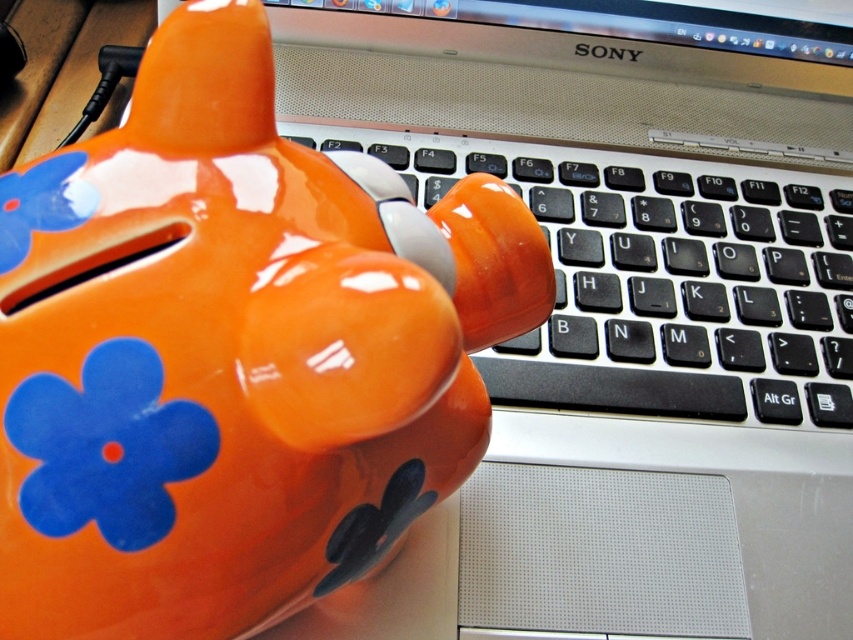
You are organizing your desk and want to place the glossy ceramic piggy bank at upper left closer to the black plastic keyboard at center. Are they currently overlapping in the image?

The glossy ceramic piggy bank at upper left is in front of the black plastic keyboard at center, so they are overlapping in the image.

You are trying to place the glossy ceramic piggy bank at upper left on top of the black plastic keyboard at center. Can the piggy bank fit entirely on the keyboard without hanging over the edges?

The glossy ceramic piggy bank at upper left is narrower than the black plastic keyboard at center, so it can fit entirely on the keyboard without hanging over the edges.